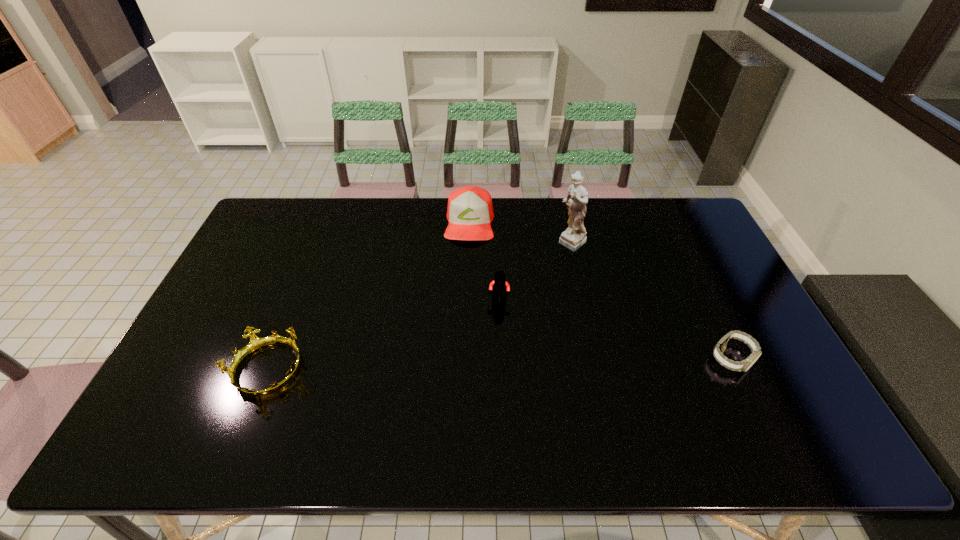
You are a GUI agent. You are given a task and a screenshot of the screen. Output one action in this format:
    pyautogui.click(x=<x>, y=<y>)
    Task: Click on the free space on the desktop that is between the leftmost object and the rightmost object and is positioned on the front-facing side of the Lego
    Image resolution: width=960 pixels, height=540 pixels.
    Given the screenshot: What is the action you would take?
    pyautogui.click(x=486, y=364)

Where is `vacant space on the desktop that is between the leftmost object and the rightmost object and is positioned on the front-facing side of the baseball cap`? This screenshot has height=540, width=960. vacant space on the desktop that is between the leftmost object and the rightmost object and is positioned on the front-facing side of the baseball cap is located at coordinates coord(461,366).

Where is `vacant space on the desktop that is between the crown and the rightmost object and is positioned on the front-facing side of the tallest object`? This screenshot has height=540, width=960. vacant space on the desktop that is between the crown and the rightmost object and is positioned on the front-facing side of the tallest object is located at coordinates (439, 366).